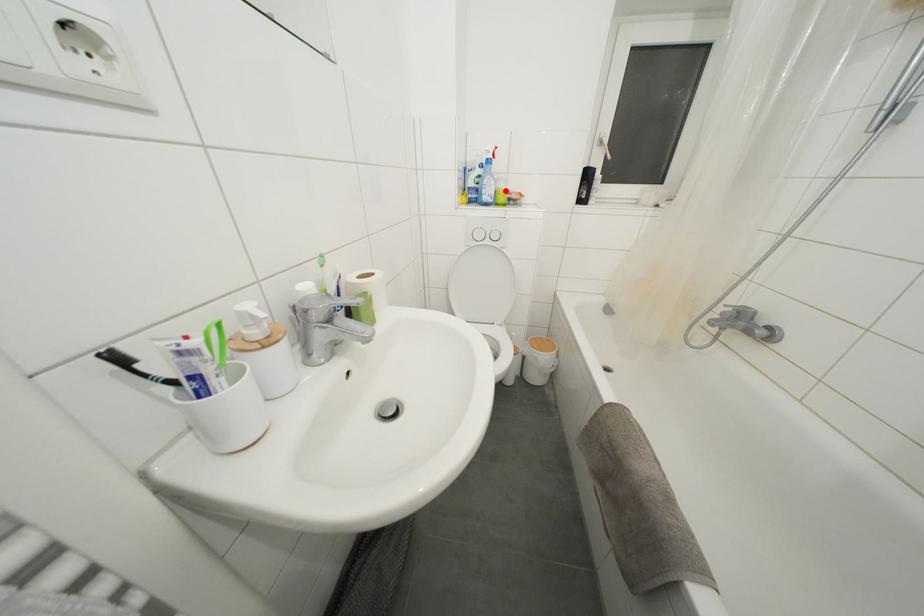
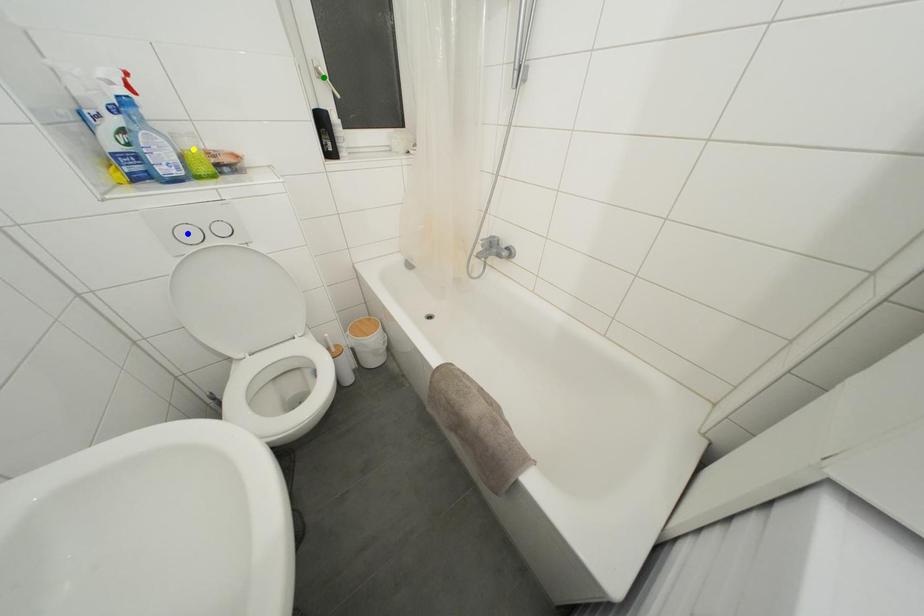
Question: I am providing you with two images of the same scene from different viewpoints. A red point is marked on the first image. You are given multiple points on the second image. Which mark in image 2 goes with the point in image 1?

Choices:
 (A) yellow point
 (B) blue point
 (C) green point

Answer: (A)